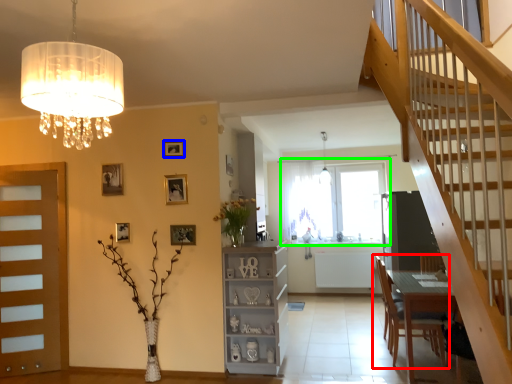
Question: Considering the real-world distances, which object is farthest from chair (highlighted by a red box)? picture frame (highlighted by a blue box) or window (highlighted by a green box)?

Choices:
 (A) picture frame
 (B) window

Answer: (A)